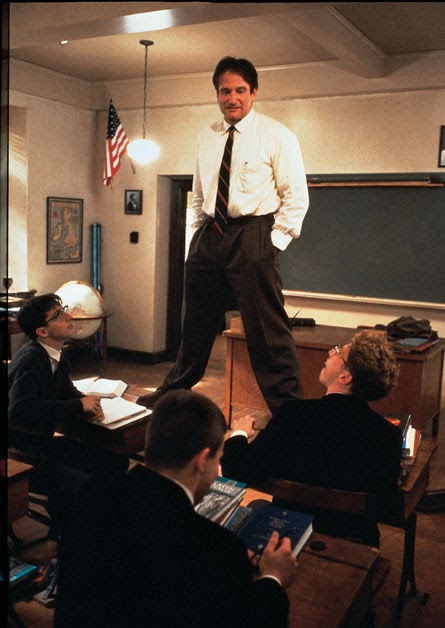
Identify the location of teacher desk. This screenshot has width=445, height=628. (313, 363).